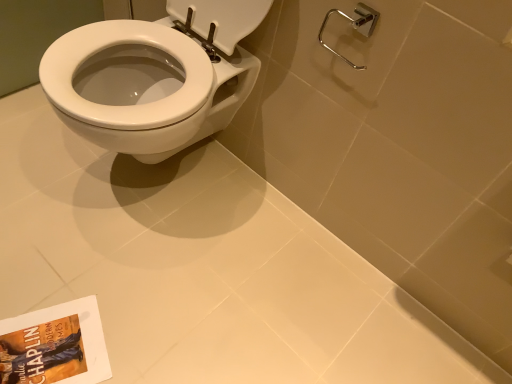
This screenshot has height=384, width=512. What do you see at coordinates (353, 26) in the screenshot?
I see `polished chrome shower at upper right` at bounding box center [353, 26].

In order to face polished chrome shower at upper right, should I rotate leftwards or rightwards?

A 12.816 degree turn to the right will do.

You are a GUI agent. You are given a task and a screenshot of the screen. Output one action in this format:
    pyautogui.click(x=<x>, y=<y>)
    Task: Click on the polished chrome shower at upper right
    
    Given the screenshot: What is the action you would take?
    pyautogui.click(x=353, y=26)

In order to face matte paper book at lower left, should I rotate leftwards or rightwards?

Rotate left and turn 27.293 degrees.

Describe the element at coordinates (55, 345) in the screenshot. I see `matte paper book at lower left` at that location.

Locate an element on the screen. matte paper book at lower left is located at coordinates (55, 345).

What is the approximate height of matte paper book at lower left?

0.57 inches.

Identify the location of polished chrome shower at upper right. Image resolution: width=512 pixels, height=384 pixels. (353, 26).

Consider the image. Which is more to the right, matte paper book at lower left or polished chrome shower at upper right?

polished chrome shower at upper right is more to the right.

Considering their positions, is matte paper book at lower left located in front of or behind polished chrome shower at upper right?

matte paper book at lower left is positioned farther from the viewer than polished chrome shower at upper right.

Between point (80, 349) and point (326, 21), which one is positioned in front?

Positioned in front is point (326, 21).

From the image's perspective, is matte paper book at lower left over polished chrome shower at upper right?

No, from the image's perspective, matte paper book at lower left is not on top of polished chrome shower at upper right.

From a real-world perspective, is matte paper book at lower left located beneath polished chrome shower at upper right?

Yes, from a real-world perspective, matte paper book at lower left is under polished chrome shower at upper right.

Does matte paper book at lower left have a lesser width compared to polished chrome shower at upper right?

Incorrect, the width of matte paper book at lower left is not less than that of polished chrome shower at upper right.

Is matte paper book at lower left shorter than polished chrome shower at upper right?

Correct, matte paper book at lower left is not as tall as polished chrome shower at upper right.

Considering the sizes of objects matte paper book at lower left and polished chrome shower at upper right in the image provided, who is bigger, matte paper book at lower left or polished chrome shower at upper right?

polished chrome shower at upper right is bigger.

Is polished chrome shower at upper right surrounded by matte paper book at lower left?

Definitely not — polished chrome shower at upper right is not inside matte paper book at lower left.

Is the surface of matte paper book at lower left in direct contact with polished chrome shower at upper right?

There is a gap between matte paper book at lower left and polished chrome shower at upper right.

Is matte paper book at lower left turned away from polished chrome shower at upper right?

That's not correct — matte paper book at lower left is not looking away from polished chrome shower at upper right.

Can you tell me how much matte paper book at lower left and polished chrome shower at upper right differ in facing direction?

The angular difference between matte paper book at lower left and polished chrome shower at upper right is 63.5 degrees.

Where is `paperback book located behind the polished chrome shower at upper right`? This screenshot has width=512, height=384. paperback book located behind the polished chrome shower at upper right is located at coordinates (55, 345).

Between polished chrome shower at upper right and matte paper book at lower left, which one appears on the right side from the viewer's perspective?

From the viewer's perspective, polished chrome shower at upper right appears more on the right side.

In the image, is polished chrome shower at upper right positioned in front of or behind matte paper book at lower left?

polished chrome shower at upper right is in front of matte paper book at lower left.

Which point is more distant from viewer, (349, 18) or (74, 331)?

The point (74, 331) is farther from the camera.

From the image's perspective, is polished chrome shower at upper right below matte paper book at lower left?

Incorrect, from the image's perspective, polished chrome shower at upper right is higher than matte paper book at lower left.

From a real-world perspective, which is physically above, polished chrome shower at upper right or matte paper book at lower left?

In real-world perspective, polished chrome shower at upper right is above.

Based on the photo, considering the sizes of polished chrome shower at upper right and matte paper book at lower left in the image, is polished chrome shower at upper right wider or thinner than matte paper book at lower left?

polished chrome shower at upper right is thinner than matte paper book at lower left.

From their relative heights in the image, would you say polished chrome shower at upper right is taller or shorter than matte paper book at lower left?

polished chrome shower at upper right is taller than matte paper book at lower left.

Can you confirm if polished chrome shower at upper right is bigger than matte paper book at lower left?

Indeed, polished chrome shower at upper right has a larger size compared to matte paper book at lower left.

Does polished chrome shower at upper right contain matte paper book at lower left?

That's incorrect, matte paper book at lower left is not inside polished chrome shower at upper right.

Is polished chrome shower at upper right touching matte paper book at lower left?

No, polished chrome shower at upper right is not touching matte paper book at lower left.

Could you tell me if polished chrome shower at upper right is facing matte paper book at lower left?

No.

The width and height of the screenshot is (512, 384). What are the coordinates of `paperback book that appears on the left of polished chrome shower at upper right` in the screenshot? It's located at (55, 345).

Identify the location of paperback book below the polished chrome shower at upper right (from a real-world perspective). The height and width of the screenshot is (384, 512). (55, 345).

Where is `shower above the matte paper book at lower left (from a real-world perspective)`? The height and width of the screenshot is (384, 512). shower above the matte paper book at lower left (from a real-world perspective) is located at coordinates (353, 26).